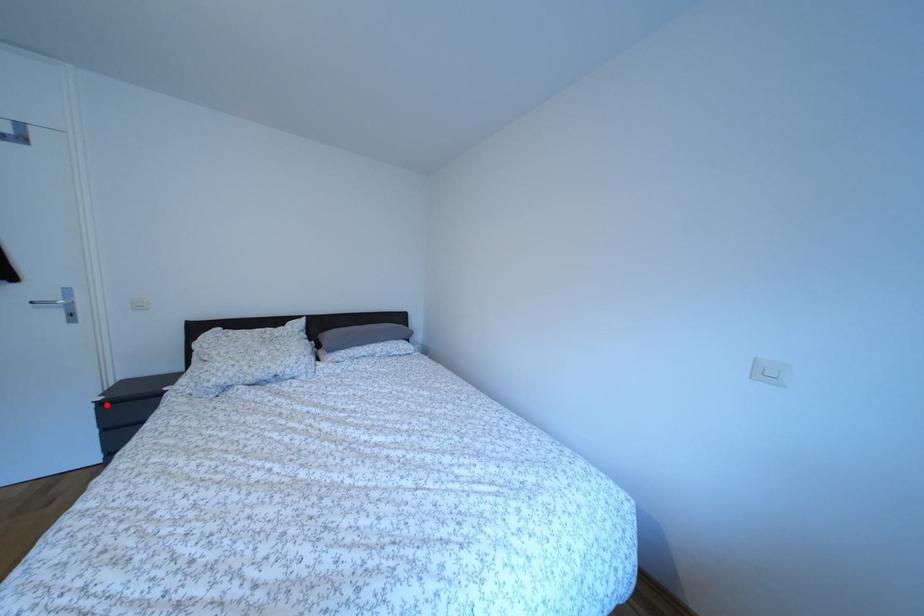
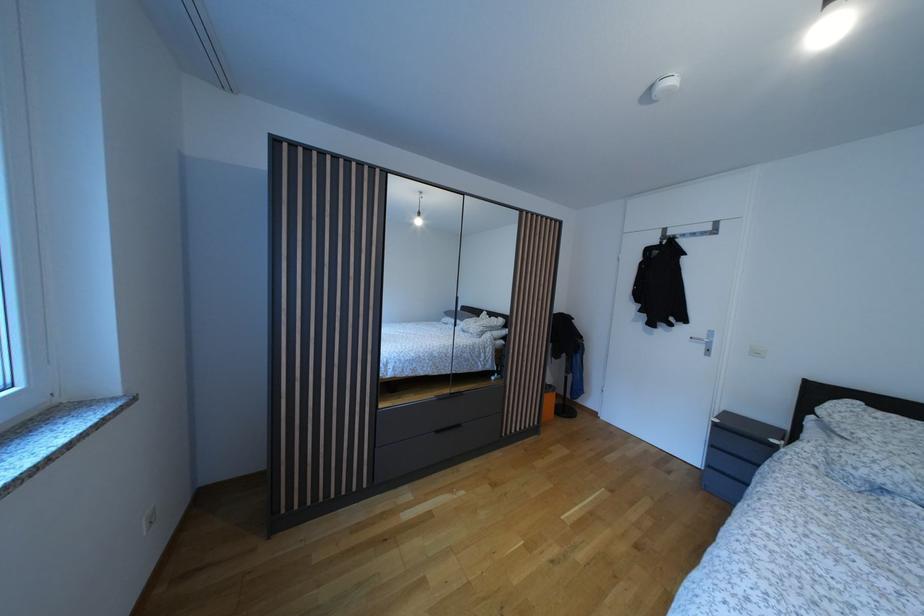
In the second image, find the point that corresponds to the highlighted location in the first image.

(723, 427)